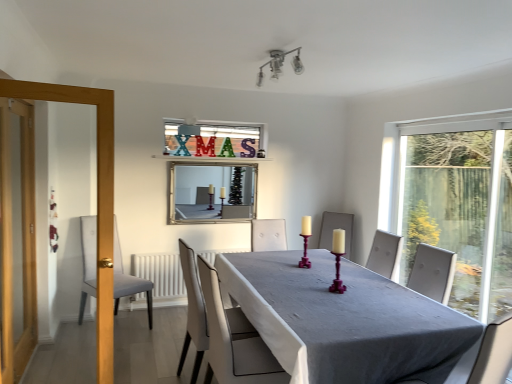
Find the location of `free space in front of purple wood candle holder at center, positioned as the 1th candle holder in back-to-front order`. free space in front of purple wood candle holder at center, positioned as the 1th candle holder in back-to-front order is located at coordinates coord(302,273).